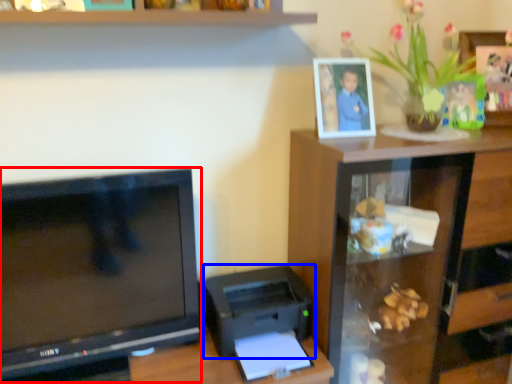
Question: Which object is further to the camera taking this photo, television (highlighted by a red box) or printer (highlighted by a blue box)?

Choices:
 (A) television
 (B) printer

Answer: (B)